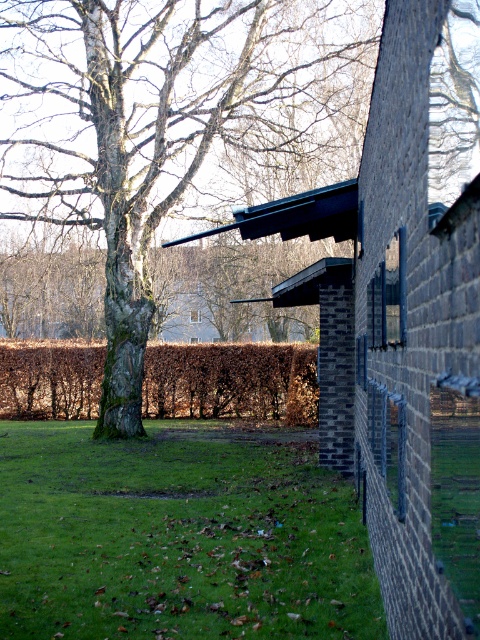
You are standing at the center of the image and want to walk towards the green grass at lower center. Based on the coordinates provided in the Objects Description, in which direction should you move?

The green grass at lower center is located at coordinates point (180, 536), which means you should move downward and to the right to reach it.

You are a gardener who needs to mow the green grass at lower center and trim the brown leafy hedge at center. Which task requires a taller tool?

The brown leafy hedge at center requires a taller tool because it is taller than the green grass at lower center.

You are a gardener planning to plant a new flower bed between the smooth bark tree at center and the green grass at lower center. Since the tree is above the grass, where should you place the flower bed to ensure it gets enough sunlight?

The flower bed should be placed between the green grass at lower center and the smooth bark tree at center. Since the smooth bark tree at center is above the green grass at lower center, positioning the flower bed closer to the grass would ensure it receives more sunlight as it is not shaded by the tree.